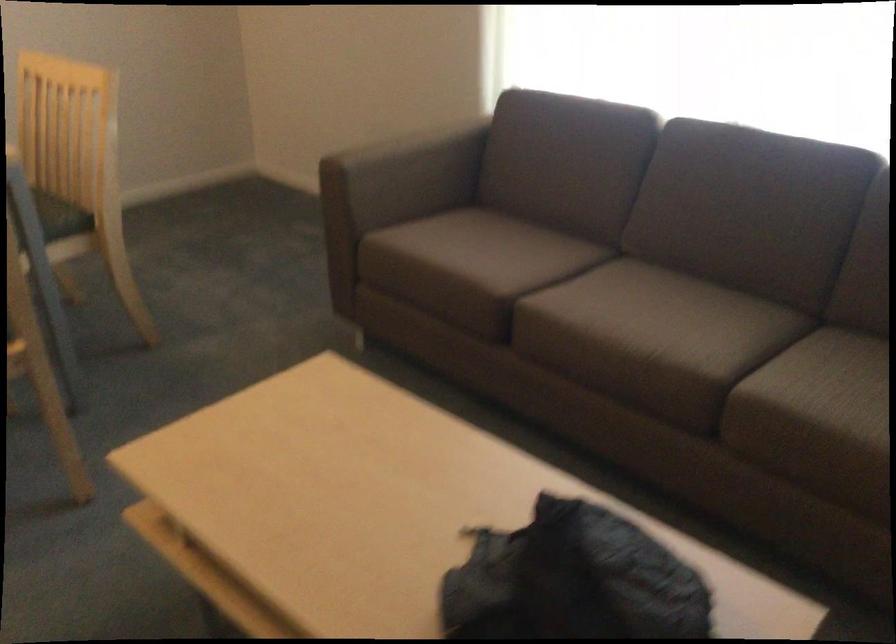
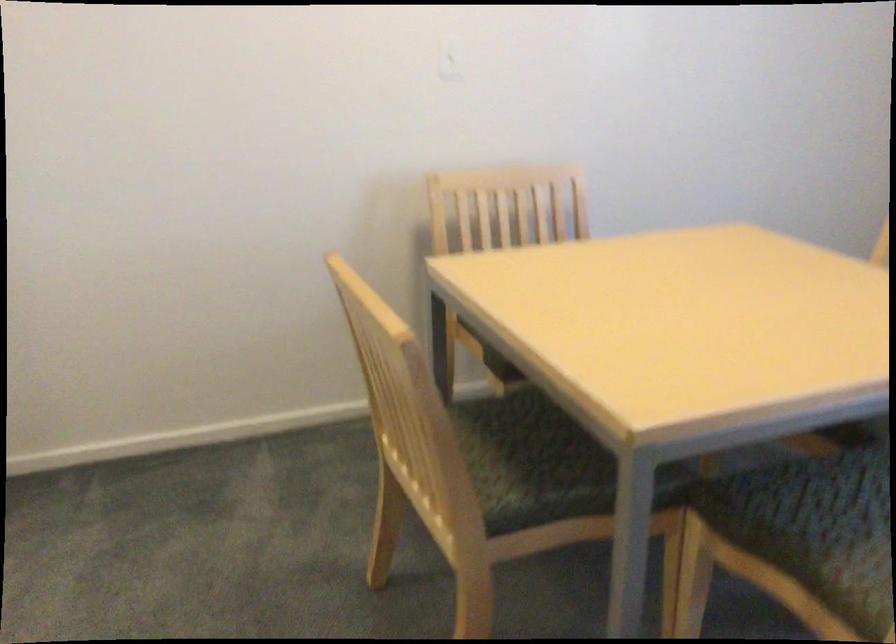
Question: What movement of the cameraman would produce the second image?

Choices:
 (A) Left
 (B) Right
 (C) Forward
 (D) Backward

Answer: (A)